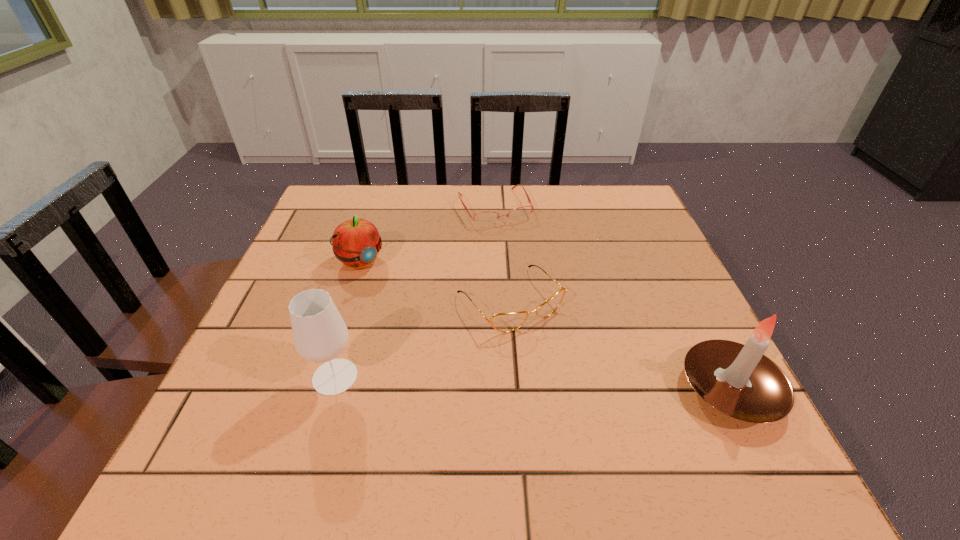
Locate an element on the screen. Image resolution: width=960 pixels, height=540 pixels. candle that is at the near edge is located at coordinates (738, 380).

I want to click on glass present at the left edge, so click(320, 334).

The width and height of the screenshot is (960, 540). Find the location of `apple present at the left edge`. apple present at the left edge is located at coordinates (356, 242).

The image size is (960, 540). Find the location of `object at the right edge`. object at the right edge is located at coordinates (738, 380).

Identify the location of object present at the near left corner. (320, 334).

Find the location of a particular element. The height and width of the screenshot is (540, 960). object that is at the near right corner is located at coordinates (738, 380).

Find the location of a particular element. free region at the far edge is located at coordinates (570, 196).

The width and height of the screenshot is (960, 540). What are the coordinates of `vacant space at the near edge` in the screenshot? It's located at (533, 415).

Identify the location of vacant region at the left edge of the desktop. (276, 369).

Identify the location of vacant space at the far right corner of the desktop. pyautogui.click(x=626, y=228).